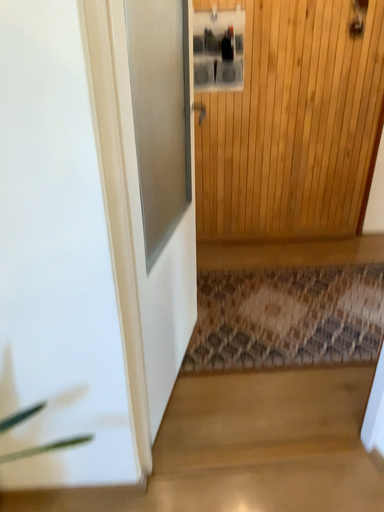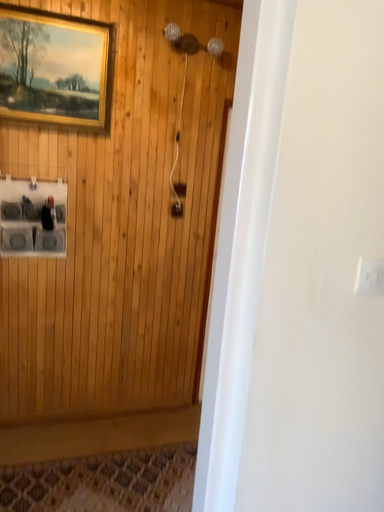
Question: How did the camera likely rotate when shooting the video?

Choices:
 (A) rotated right
 (B) rotated left

Answer: (A)